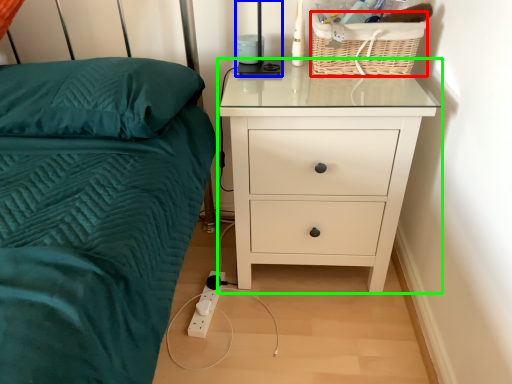
Question: Which object is positioned closest to basket (highlighted by a red box)? Select from bedside lamp (highlighted by a blue box) and chest of drawers (highlighted by a green box).

Choices:
 (A) bedside lamp
 (B) chest of drawers

Answer: (A)